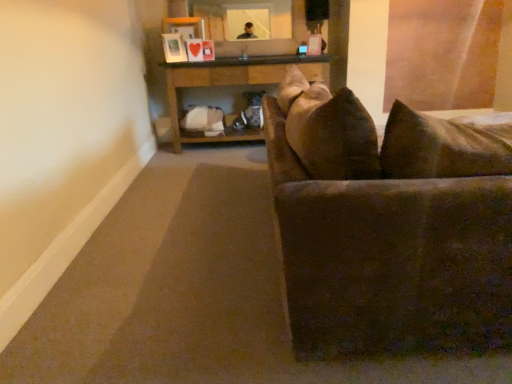
Image resolution: width=512 pixels, height=384 pixels. I want to click on wooden table at center, so click(232, 84).

The image size is (512, 384). What do you see at coordinates (232, 84) in the screenshot?
I see `wooden table at center` at bounding box center [232, 84].

Find the location of a particular element. brown fabric couch at right is located at coordinates (389, 225).

What do you see at coordinates (389, 225) in the screenshot? The height and width of the screenshot is (384, 512). I see `brown fabric couch at right` at bounding box center [389, 225].

Image resolution: width=512 pixels, height=384 pixels. I want to click on wooden table at center, so click(x=232, y=84).

Does wooden table at center appear on the left side of brown fabric couch at right?

Correct, you'll find wooden table at center to the left of brown fabric couch at right.

Which is in front, wooden table at center or brown fabric couch at right?

brown fabric couch at right.

Which point is more distant from viewer, (172, 131) or (496, 142)?

Point (172, 131)

From the image's perspective, between wooden table at center and brown fabric couch at right, who is located below?

brown fabric couch at right appears lower in the image.

From a real-world perspective, between wooden table at center and brown fabric couch at right, who is vertically higher?

In real-world perspective, brown fabric couch at right is above.

From the picture: Which object is thinner, wooden table at center or brown fabric couch at right?

With smaller width is wooden table at center.

Is wooden table at center taller or shorter than brown fabric couch at right?

Clearly, wooden table at center is shorter compared to brown fabric couch at right.

Based on their sizes in the image, would you say wooden table at center is bigger or smaller than brown fabric couch at right?

wooden table at center is smaller than brown fabric couch at right.

Is wooden table at center situated inside brown fabric couch at right or outside?

wooden table at center is not inside brown fabric couch at right, it's outside.

Is wooden table at center not near brown fabric couch at right?

Absolutely, wooden table at center is distant from brown fabric couch at right.

Is wooden table at center facing towards brown fabric couch at right?

Yes, wooden table at center is aimed at brown fabric couch at right.

What's the angular difference between wooden table at center and brown fabric couch at right's facing directions?

The angular difference between wooden table at center and brown fabric couch at right is 179 degrees.

This screenshot has width=512, height=384. In order to click on studio couch located on the right of wooden table at center in this screenshot , I will do `click(389, 225)`.

Considering the positions of objects brown fabric couch at right and wooden table at center in the image provided, who is more to the left, brown fabric couch at right or wooden table at center?

From the viewer's perspective, wooden table at center appears more on the left side.

Who is more distant, brown fabric couch at right or wooden table at center?

wooden table at center.

Between point (312, 171) and point (255, 84), which one is positioned in front?

The point (312, 171) is closer to the camera.

From the image's perspective, is brown fabric couch at right on top of wooden table at center?

No, from the image's perspective, brown fabric couch at right is not above wooden table at center.

From a real-world perspective, which is physically below, brown fabric couch at right or wooden table at center?

From a 3D spatial view, wooden table at center is below.

Between brown fabric couch at right and wooden table at center, which one has smaller width?

With smaller width is wooden table at center.

Which of these two, brown fabric couch at right or wooden table at center, stands shorter?

wooden table at center.

Can you confirm if brown fabric couch at right is smaller than wooden table at center?

Actually, brown fabric couch at right might be larger than wooden table at center.

Can wooden table at center be found inside brown fabric couch at right?

That's incorrect, wooden table at center is not inside brown fabric couch at right.

Would you consider brown fabric couch at right to be distant from wooden table at center?

Yes, brown fabric couch at right is far from wooden table at center.

Is brown fabric couch at right oriented away from wooden table at center?

No, brown fabric couch at right's orientation is not away from wooden table at center.

What's the angular difference between brown fabric couch at right and wooden table at center's facing directions?

The angular difference between brown fabric couch at right and wooden table at center is 179 degrees.

Find the location of a particular element. Image resolution: width=512 pixels, height=384 pixels. studio couch on the right of the wooden table at center is located at coordinates (389, 225).

This screenshot has width=512, height=384. What are the coordinates of `table on the left of brown fabric couch at right` in the screenshot? It's located at (232, 84).

You are a GUI agent. You are given a task and a screenshot of the screen. Output one action in this format:
    pyautogui.click(x=<x>, y=<y>)
    Task: Click on the studio couch in front of the wooden table at center
    The height and width of the screenshot is (384, 512).
    Given the screenshot: What is the action you would take?
    pyautogui.click(x=389, y=225)